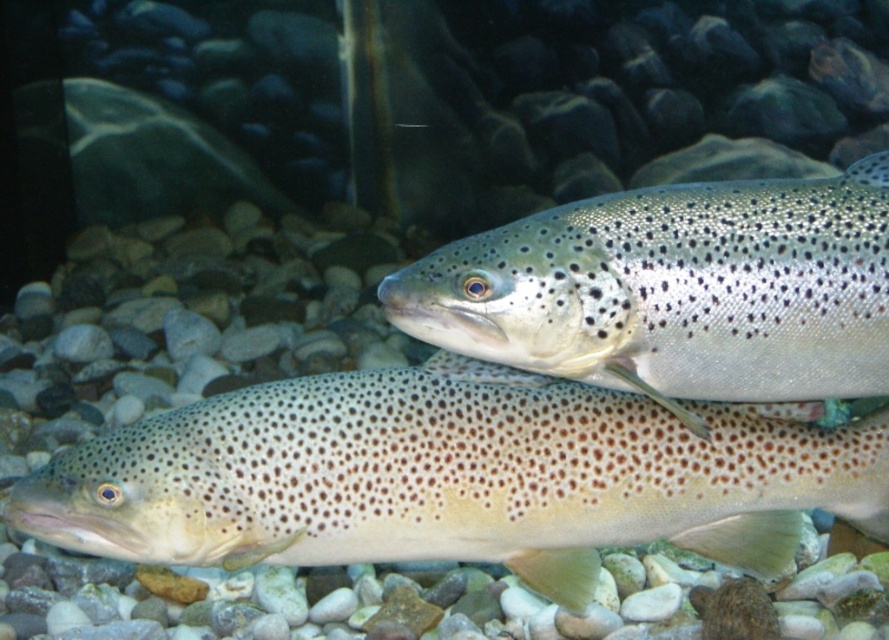
You are an aquatic biologist observing the aquarium. You notice a point marked at coordinates (454, 477). Based on the scene, what does this point likely indicate?

The point at (454, 477) corresponds to the speckled skin fish at center, indicating its location in the aquarium.

Based on the photo, you are an aquarium keeper who needs to ensure that both the speckled skin fish at center and the speckled silver fish at center can swim comfortably in their tank. If the tank has a narrow section that only accommodates fish up to the size of the smaller one, which fish should you place in that area?

The speckled silver fish at center should be placed in the narrow section since its width is smaller than the speckled skin fish at center, making it suitable for the restricted space.

From the picture: You are an aquarium keeper who needs to ensure the two fish in the tank have enough space. The tank has a 120 cm length. The speckled skin fish at center requires 60 cm of space, while the speckled silver fish at center needs 30 cm. Can both fish comfortably fit in the tank?

The speckled skin fish at center requires 60 cm and the speckled silver fish at center needs 30 cm, totaling 90 cm. Since the tank is 120 cm long, both fish can comfortably fit with 30 cm of extra space remaining.